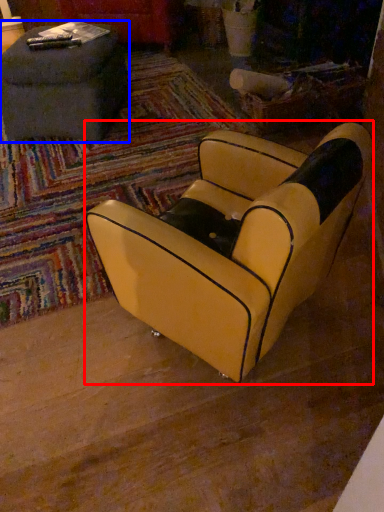
Question: Which point is further to the camera, chair (highlighted by a red box) or table (highlighted by a blue box)?

Choices:
 (A) chair
 (B) table

Answer: (B)